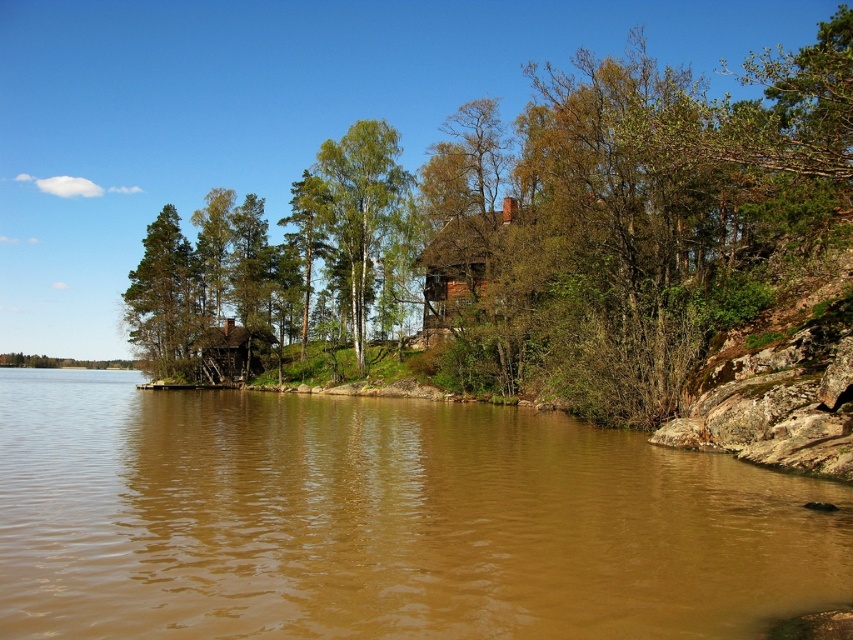
Who is more forward, (x=622, y=566) or (x=352, y=284)?

Point (x=622, y=566)

Does point (13, 410) come behind point (335, 186)?

No, (13, 410) is in front of (335, 186).

What do you see at coordinates (384, 520) in the screenshot?
I see `brown muddy water at lower left` at bounding box center [384, 520].

Image resolution: width=853 pixels, height=640 pixels. I want to click on brown muddy water at lower left, so click(384, 520).

Which of these two, green leafy tree at center or green matte tree at upper left, stands taller?

green leafy tree at center

Which is behind, point (384, 248) or point (181, 374)?

Point (181, 374)

Who is more forward, (805, 88) or (157, 298)?

Point (805, 88) is in front.

At what (x,y) coordinates should I click in order to perform the action: click on green leafy tree at center. Please return your answer as a coordinate pair (x, y). The width and height of the screenshot is (853, 640). Looking at the image, I should click on (561, 227).

Which is behind, point (654, 257) or point (381, 195)?

The point (381, 195) is more distant.

Is green leafy tree at center thinner than green matte tree at center?

No, green leafy tree at center is not thinner than green matte tree at center.

Locate an element on the screen. The height and width of the screenshot is (640, 853). green leafy tree at center is located at coordinates (561, 227).

The image size is (853, 640). Find the location of `green leafy tree at center`. green leafy tree at center is located at coordinates (561, 227).